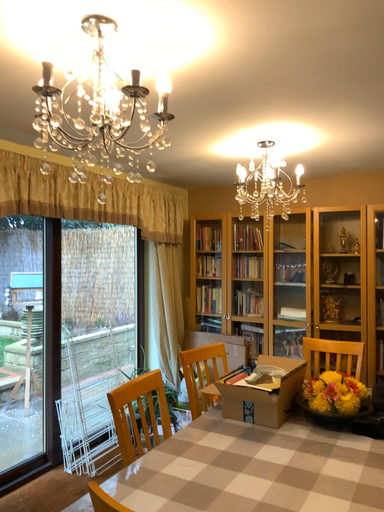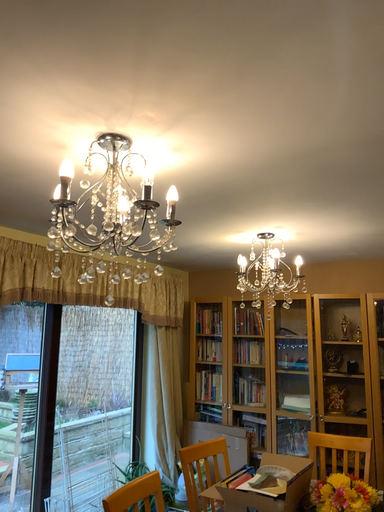
Question: Which way did the camera rotate in the video?

Choices:
 (A) rotated downward
 (B) rotated upward

Answer: (B)